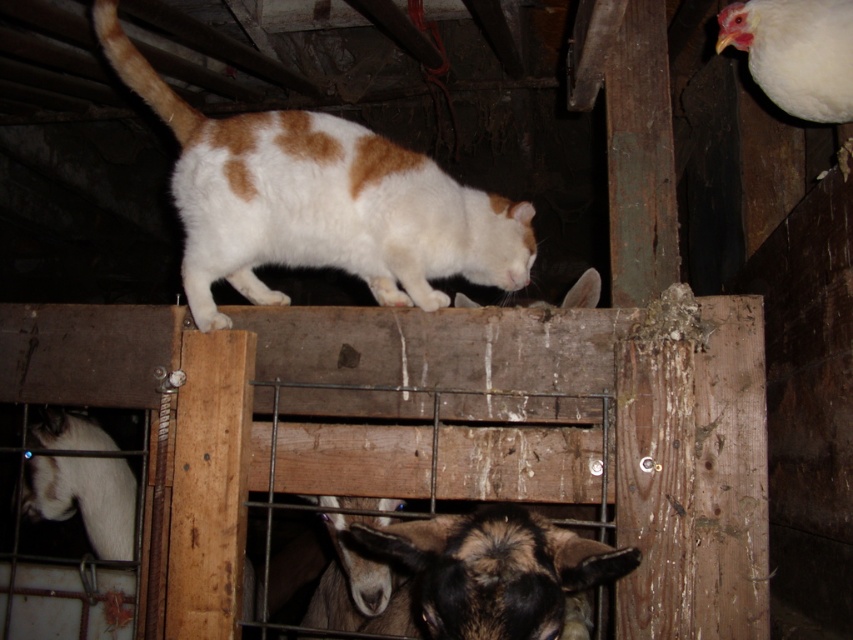
Which is below, white fur cat at upper center or brown fuzzy goat at lower center?

brown fuzzy goat at lower center is below.

Where is `white fur cat at upper center`? The image size is (853, 640). white fur cat at upper center is located at coordinates (318, 202).

Between white fur cat at upper center and white woolen goat at lower left, which one is positioned lower?

Positioned lower is white woolen goat at lower left.

Between white fur cat at upper center and white woolen goat at lower left, which one appears on the left side from the viewer's perspective?

white woolen goat at lower left

The height and width of the screenshot is (640, 853). What are the coordinates of `white fur cat at upper center` in the screenshot? It's located at (318, 202).

Locate an element on the screen. white fur cat at upper center is located at coordinates (318, 202).

Consider the image. Which of these two, brown fuzzy goat at lower center or white woolen goat at lower left, stands shorter?

With less height is brown fuzzy goat at lower center.

In the scene shown: Is brown fuzzy goat at lower center positioned at the back of white woolen goat at lower left?

No, it is in front of white woolen goat at lower left.

Does point (474, 602) come in front of point (30, 490)?

That is True.

Find the location of a particular element. The width and height of the screenshot is (853, 640). brown fuzzy goat at lower center is located at coordinates (490, 572).